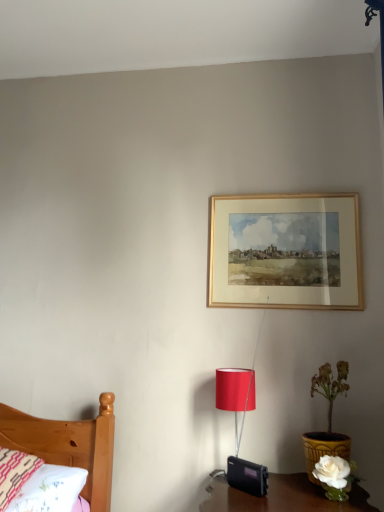
Question: Relative to white ceramic vase at lower right, is matte red lampshade at lower center in front or behind?

Choices:
 (A) behind
 (B) front

Answer: (A)

Question: Is matte red lampshade at lower center taller or shorter than white ceramic vase at lower right?

Choices:
 (A) short
 (B) tall

Answer: (A)

Question: Estimate the real-world distances between objects in this image. Which object is farther from the matte red lampshade at lower center?

Choices:
 (A) white ceramic vase at lower right
 (B) embroidered cotton pillow at lower left
 (C) gold wooden picture frame at upper center

Answer: (B)

Question: Estimate the real-world distances between objects in this image. Which object is farther from the white ceramic vase at lower right?

Choices:
 (A) gold wooden picture frame at upper center
 (B) matte red lampshade at lower center
 (C) embroidered cotton pillow at lower left

Answer: (C)